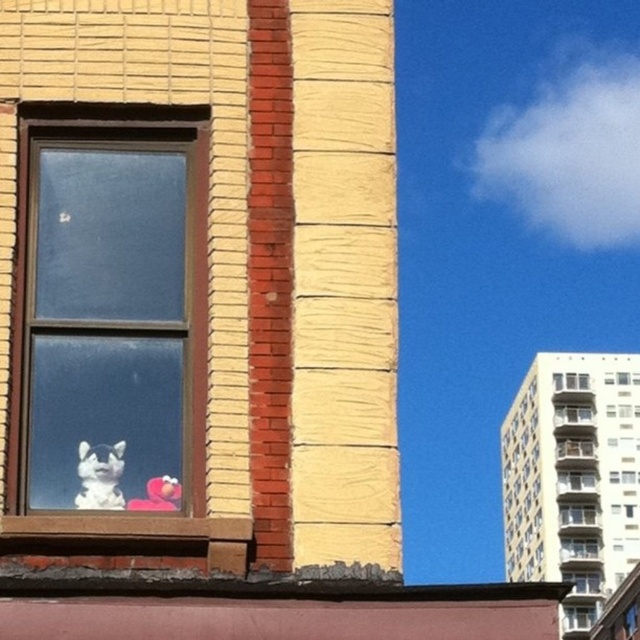
Question: Does fluffy white cat at window left have a lesser width compared to clear glass window at upper right?

Choices:
 (A) no
 (B) yes

Answer: (B)

Question: Which point is farther from the camera taking this photo?

Choices:
 (A) (577, 372)
 (B) (97, 468)
 (C) (84, 282)

Answer: (A)

Question: Does fluffy white cat at window left have a greater width compared to clear glass window at upper right?

Choices:
 (A) yes
 (B) no

Answer: (B)

Question: Can you confirm if clear glass window at left is positioned above fluffy white cat at window left?

Choices:
 (A) no
 (B) yes

Answer: (B)

Question: Which object is farther from the camera taking this photo?

Choices:
 (A) fluffy white cat at window left
 (B) clear glass window at upper right

Answer: (B)

Question: Which point is farther to the camera?

Choices:
 (A) fluffy white cat at window left
 (B) clear glass window at left

Answer: (A)